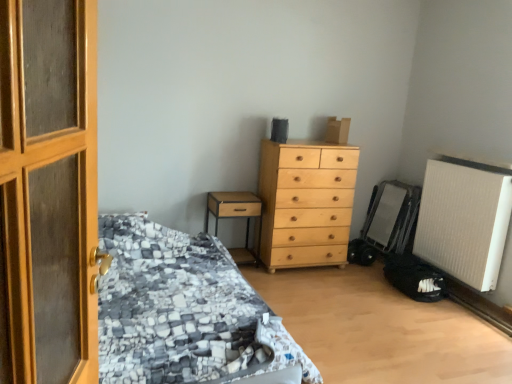
You are a GUI agent. You are given a task and a screenshot of the screen. Output one action in this format:
    pyautogui.click(x=<x>, y=<y>)
    Task: Click on the empty space that is ontop of white textured radiator at lower right
    
    Given the screenshot: What is the action you would take?
    tap(476, 162)